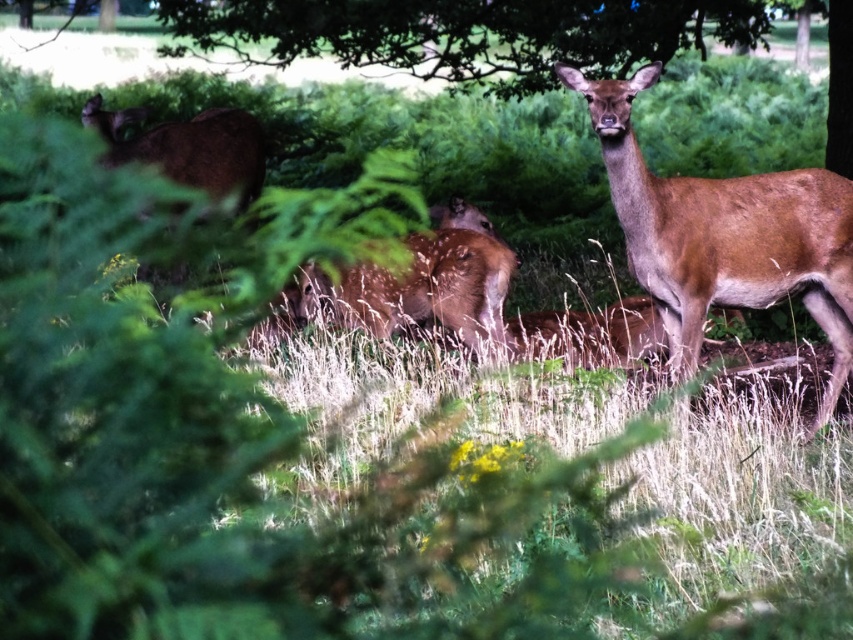
You are a photographer trying to capture the brown fur deer at center without the green leafy tree at upper center blocking the view. Can you determine if the tree is thinner than the deer?

The green leafy tree at upper center is thinner than the brown fur deer at center, so it would not block the deer completely. However, since the tree is positioned at upper center, it might still partially obstruct the deer depending on your angle and framing.

You are a photographer trying to capture the brown fur deer at center without the green leafy tree at upper center blocking the view. Can you move to a position where the deer is visible without the tree obstructing it?

The green leafy tree at upper center is positioned over the brown fur deer at center, so moving to a lower angle or position might allow you to see the deer without the tree blocking the view.

You are a photographer trying to capture a clear shot of the brown fur deer at center without the green leafy tree at upper center blocking it. Based on their sizes in the image, is it possible to adjust your camera angle to avoid the tree while still framing the deer?

The green leafy tree at upper center occupies less space than the brown fur deer at center, so adjusting the camera angle might allow you to frame the deer while avoiding the smaller tree.